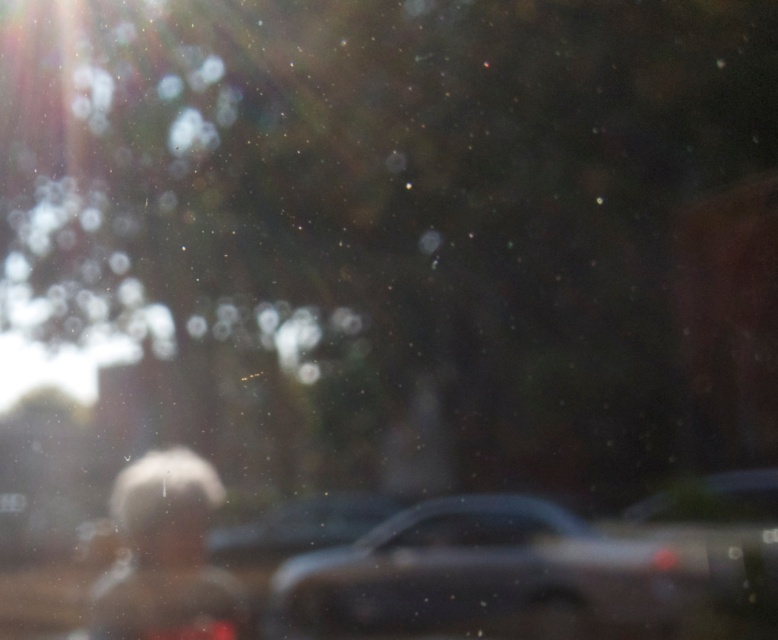
Can you confirm if metallic gray car at center is positioned below transparent glass car window at center?

Yes, metallic gray car at center is below transparent glass car window at center.

Which is below, metallic gray car at center or transparent glass car window at center?

metallic gray car at center

Does point (654, 541) come behind point (524, 536)?

No, (654, 541) is closer to viewer.

The width and height of the screenshot is (778, 640). I want to click on metallic gray car at center, so click(x=486, y=577).

What do you see at coordinates (486, 577) in the screenshot? I see `metallic gray car at center` at bounding box center [486, 577].

Does metallic gray car at center appear under white matte hair at center?

Actually, metallic gray car at center is above white matte hair at center.

Who is more distant from viewer, (524, 528) or (125, 509)?

Point (524, 528)

The width and height of the screenshot is (778, 640). I want to click on metallic gray car at center, so click(x=486, y=577).

In the scene shown: Does white matte hair at center have a lesser height compared to transparent glass car window at center?

No.

Which of these two, white matte hair at center or transparent glass car window at center, stands taller?

With more height is white matte hair at center.

Who is more distant from viewer, (159, 598) or (421, 522)?

The point (421, 522) is more distant.

I want to click on white matte hair at center, so click(x=166, y=556).